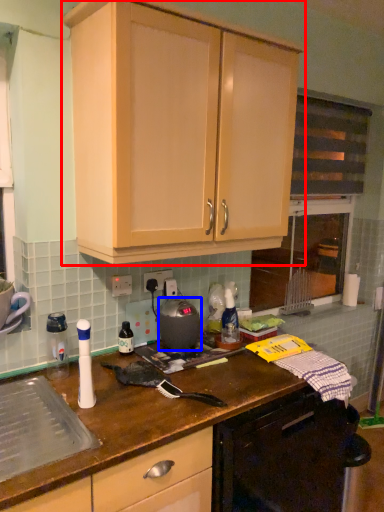
Question: Among these objects, which one is nearest to the camera, cabinetry (highlighted by a red box) or kitchen appliance (highlighted by a blue box)?

Choices:
 (A) cabinetry
 (B) kitchen appliance

Answer: (A)